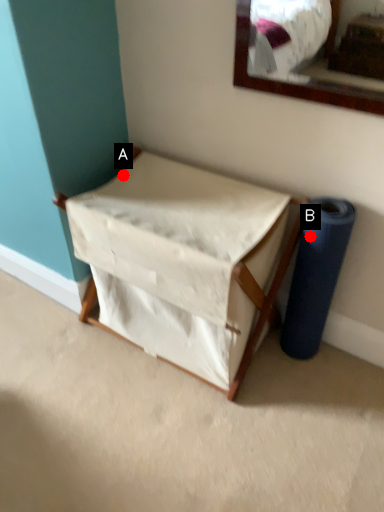
Question: Two points are circled on the image, labeled by A and B beside each circle. Which point is closer to the camera?

Choices:
 (A) A is closer
 (B) B is closer

Answer: (B)